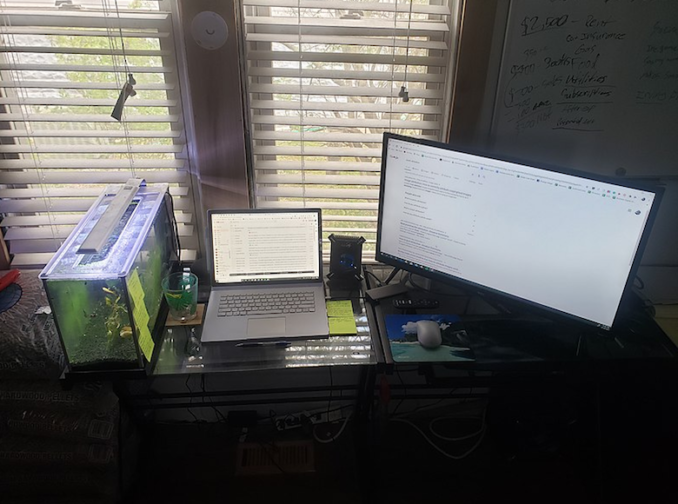
Locate an element on the screen. Image resolution: width=678 pixels, height=504 pixels. aquarium is located at coordinates (96, 305).